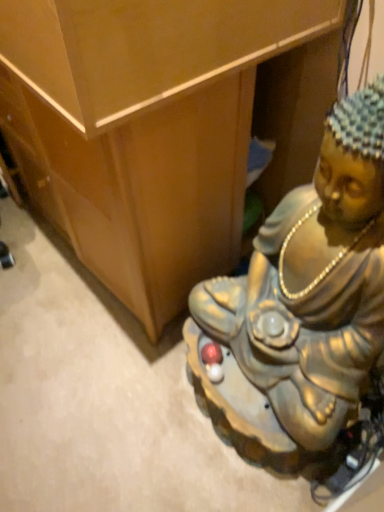
Where is `metallic gold statue at lower right`? metallic gold statue at lower right is located at coordinates (314, 283).

What is the approximate width of metallic gold statue at lower right?

17.93 inches.

This screenshot has width=384, height=512. Describe the element at coordinates (314, 283) in the screenshot. I see `metallic gold statue at lower right` at that location.

Locate an element on the screen. The image size is (384, 512). metallic statue at lower right is located at coordinates (143, 128).

Describe the element at coordinates (143, 128) in the screenshot. Image resolution: width=384 pixels, height=512 pixels. I see `metallic statue at lower right` at that location.

What is the approximate width of metallic statue at lower right?

It is 3.43 feet.

The width and height of the screenshot is (384, 512). Find the location of `metallic gold statue at lower right`. metallic gold statue at lower right is located at coordinates (314, 283).

Between metallic statue at lower right and metallic gold statue at lower right, which one appears on the right side from the viewer's perspective?

metallic gold statue at lower right.

Does metallic statue at lower right lie behind metallic gold statue at lower right?

Yes, the depth of metallic statue at lower right is greater than that of metallic gold statue at lower right.

Is point (129, 219) less distant than point (343, 180)?

No, (129, 219) is further to viewer.

From the image's perspective, which one is positioned higher, metallic statue at lower right or metallic gold statue at lower right?

metallic statue at lower right.

From a real-world perspective, who is located lower, metallic statue at lower right or metallic gold statue at lower right?

metallic statue at lower right, from a real-world perspective.

Which of these two, metallic statue at lower right or metallic gold statue at lower right, is wider?

metallic statue at lower right is wider.

Considering the sizes of objects metallic statue at lower right and metallic gold statue at lower right in the image provided, who is shorter, metallic statue at lower right or metallic gold statue at lower right?

With less height is metallic statue at lower right.

Looking at the image, does metallic statue at lower right seem bigger or smaller compared to metallic gold statue at lower right?

Considering their sizes, metallic statue at lower right takes up less space than metallic gold statue at lower right.

In the scene shown: Which is correct: metallic statue at lower right is inside metallic gold statue at lower right, or outside of it?

metallic statue at lower right lies outside metallic gold statue at lower right.

Is metallic statue at lower right next to metallic gold statue at lower right?

metallic statue at lower right and metallic gold statue at lower right are not in contact.

From the picture: Is metallic statue at lower right aimed at metallic gold statue at lower right?

No, metallic statue at lower right is not aimed at metallic gold statue at lower right.

How many degrees apart are the facing directions of metallic statue at lower right and metallic gold statue at lower right?

There is a 180-degree angle between the facing directions of metallic statue at lower right and metallic gold statue at lower right.

At what (x,y) coordinates should I click in order to perform the action: click on furniture above the metallic gold statue at lower right (from the image's perspective). Please return your answer as a coordinate pair (x, y). This screenshot has width=384, height=512. Looking at the image, I should click on (143, 128).

Consider the image. Between metallic gold statue at lower right and metallic statue at lower right, which one appears on the right side from the viewer's perspective?

metallic gold statue at lower right is more to the right.

Is metallic gold statue at lower right further to camera compared to metallic statue at lower right?

No, the depth of metallic gold statue at lower right is less than that of metallic statue at lower right.

Which is closer, [354,197] or [149,234]?

Point [354,197]

In the scene shown: From the image's perspective, does metallic gold statue at lower right appear higher than metallic statue at lower right?

Incorrect, from the image's perspective, metallic gold statue at lower right is lower than metallic statue at lower right.

From a real-world perspective, is metallic gold statue at lower right below metallic statue at lower right?

Incorrect, from a real-world perspective, metallic gold statue at lower right is higher than metallic statue at lower right.

Considering the relative sizes of metallic gold statue at lower right and metallic statue at lower right in the image provided, is metallic gold statue at lower right wider than metallic statue at lower right?

In fact, metallic gold statue at lower right might be narrower than metallic statue at lower right.

Between metallic gold statue at lower right and metallic statue at lower right, which one has more height?

With more height is metallic gold statue at lower right.

Which of these two, metallic gold statue at lower right or metallic statue at lower right, is bigger?

With larger size is metallic gold statue at lower right.

Is metallic gold statue at lower right outside of metallic statue at lower right?

Yes, metallic gold statue at lower right is not within metallic statue at lower right.

Does metallic gold statue at lower right touch metallic statue at lower right?

No, metallic gold statue at lower right is not beside metallic statue at lower right.

Is metallic statue at lower right at the back of metallic gold statue at lower right?

No.

How far apart are metallic gold statue at lower right and metallic statue at lower right?

A distance of 12.99 inches exists between metallic gold statue at lower right and metallic statue at lower right.

The image size is (384, 512). What are the coordinates of `furniture behind the metallic gold statue at lower right` in the screenshot? It's located at (143, 128).

The width and height of the screenshot is (384, 512). In the image, there is a metallic statue at lower right. In order to click on person below it (from the image's perspective) in this screenshot , I will do `click(314, 283)`.

At what (x,y) coordinates should I click in order to perform the action: click on furniture below the metallic gold statue at lower right (from a real-world perspective). Please return your answer as a coordinate pair (x, y). The width and height of the screenshot is (384, 512). Looking at the image, I should click on (143, 128).